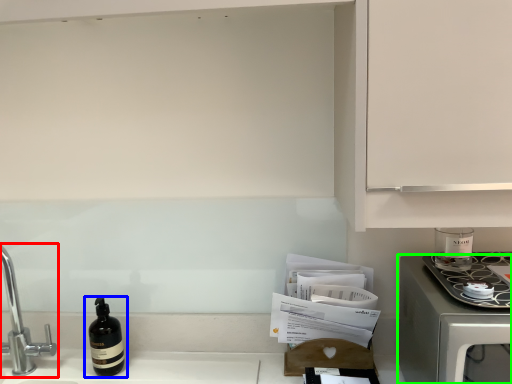
Question: Estimate the real-world distances between objects in this image. Which object is farther from tap (highlighted by a red box), bottle (highlighted by a blue box) or home appliance (highlighted by a green box)?

Choices:
 (A) bottle
 (B) home appliance

Answer: (B)